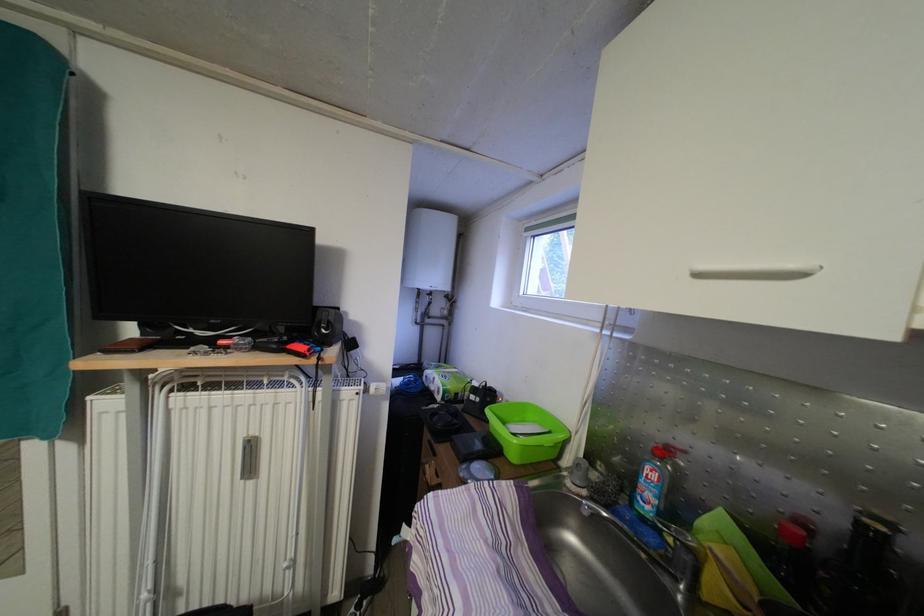
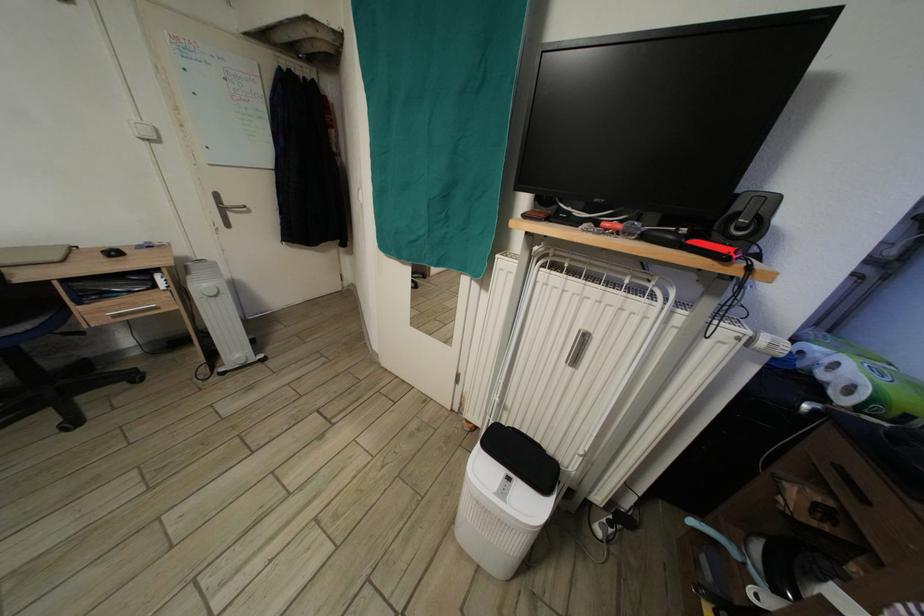
In the second image, find the point that corresponds to point 439,394 in the first image.

(830, 383)